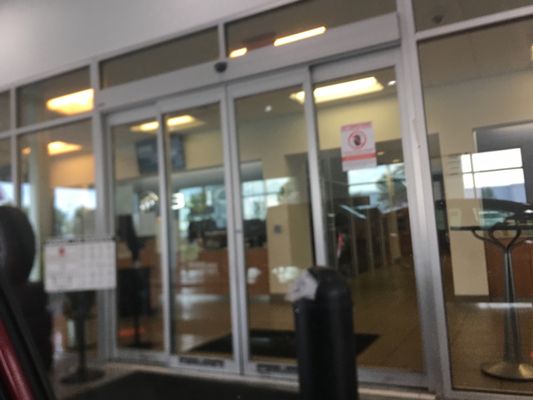
At what (x,y) coordinates should I click in order to perform the action: click on sign on door. Please return your answer as a coordinate pair (x, y). Looking at the image, I should click on (363, 154).